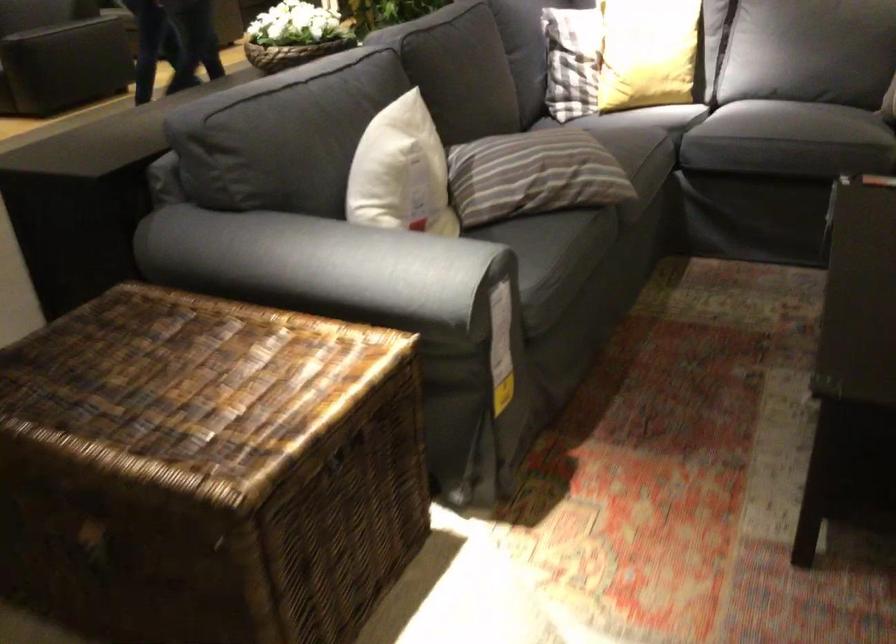
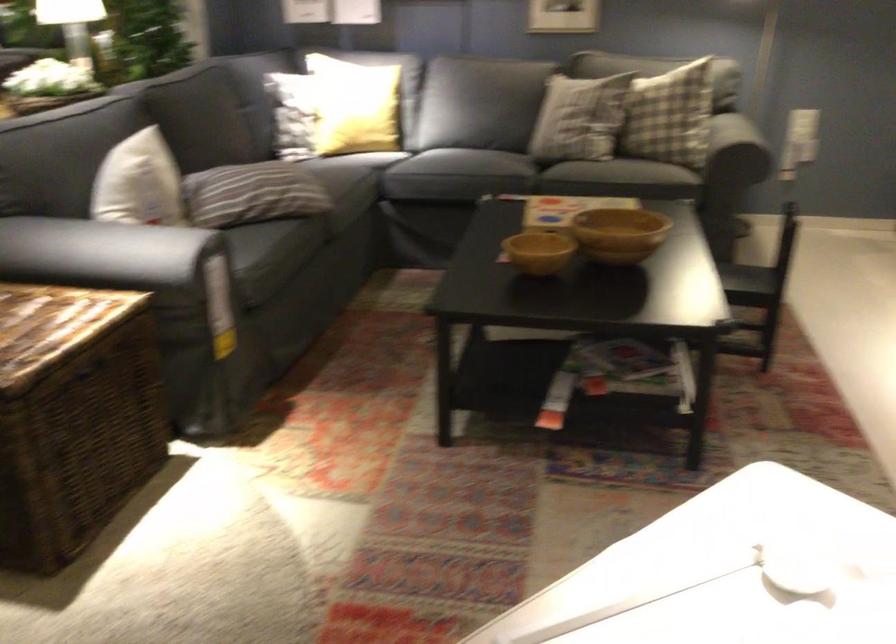
Find the pixel in the second image that matches point (546, 178) in the first image.

(261, 194)